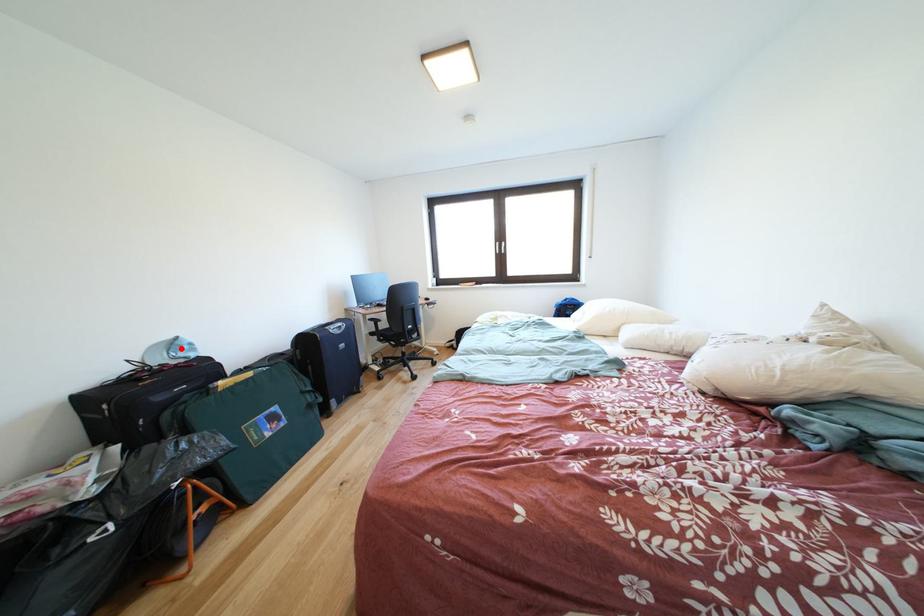
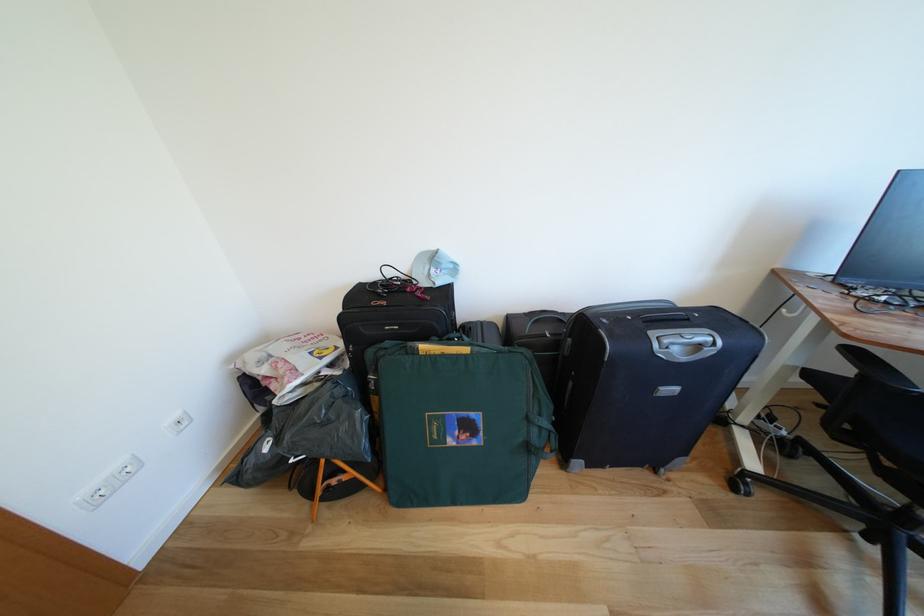
Question: I am providing you with two images of the same scene from different viewpoints. A red point is marked on the first image. Can you still see the location of the red point in image 2?

Choices:
 (A) Yes
 (B) No

Answer: (A)